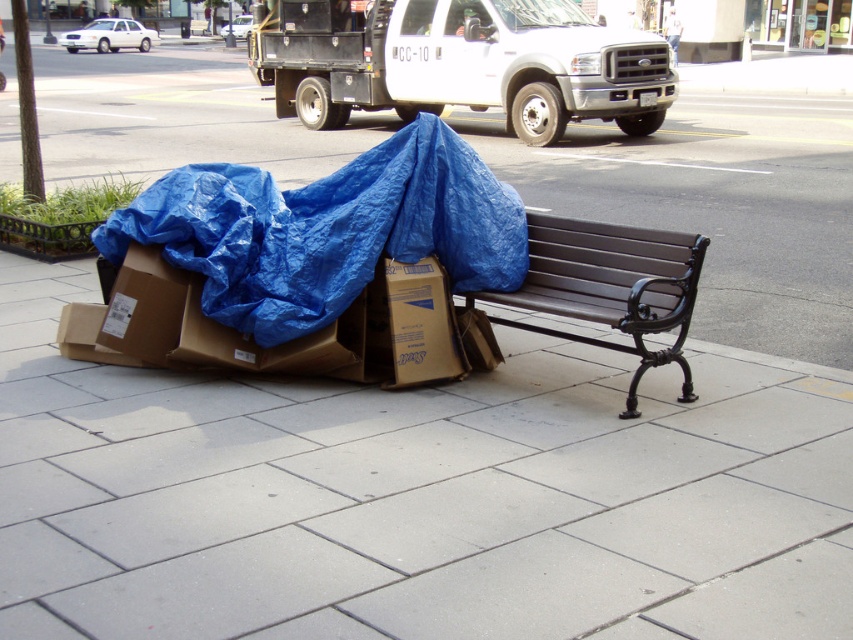
Question: Is smooth concrete pavement at lower center smaller than brown cardboard box at lower center?

Choices:
 (A) yes
 (B) no

Answer: (B)

Question: Which is nearer to the brown wooden bench at center?

Choices:
 (A) brown cardboard box at lower center
 (B) blue tarp at lower left
 (C) smooth concrete pavement at lower center

Answer: (A)

Question: Can you confirm if blue tarp at lower left is wider than brown cardboard box at lower center?

Choices:
 (A) yes
 (B) no

Answer: (A)

Question: Is smooth concrete pavement at lower center above brown cardboard box at lower center?

Choices:
 (A) yes
 (B) no

Answer: (B)

Question: Which point appears closest to the camera in this image?

Choices:
 (A) (514, 252)
 (B) (537, 250)

Answer: (A)

Question: Among these objects, which one is nearest to the camera?

Choices:
 (A) blue tarp at lower left
 (B) smooth concrete pavement at lower center
 (C) brown cardboard box at lower center

Answer: (B)